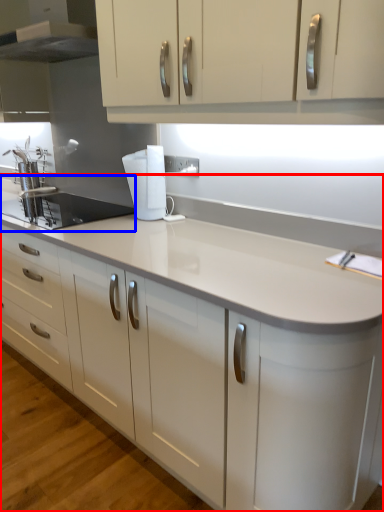
Question: Which point is closer to the camera, countertop (highlighted by a red box) or sink (highlighted by a blue box)?

Choices:
 (A) countertop
 (B) sink

Answer: (A)